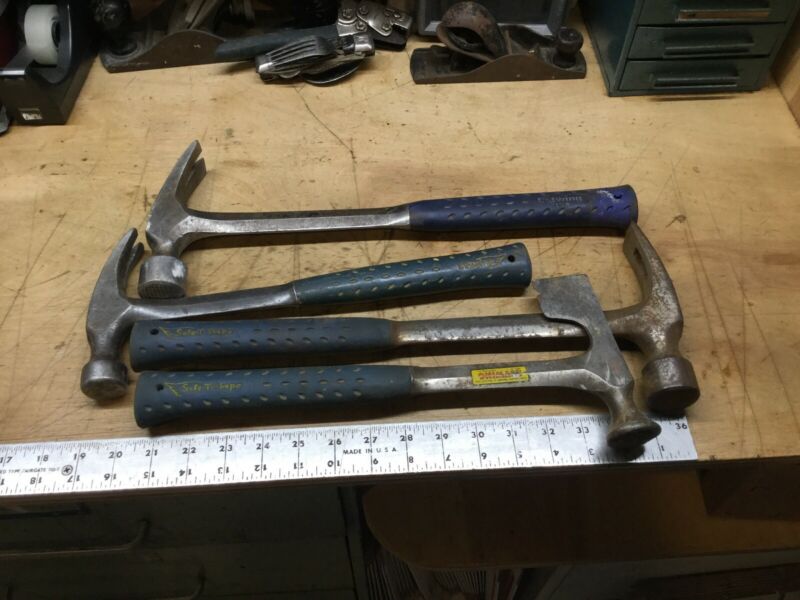
Identify the location of handle. The image size is (800, 600). (110, 548).